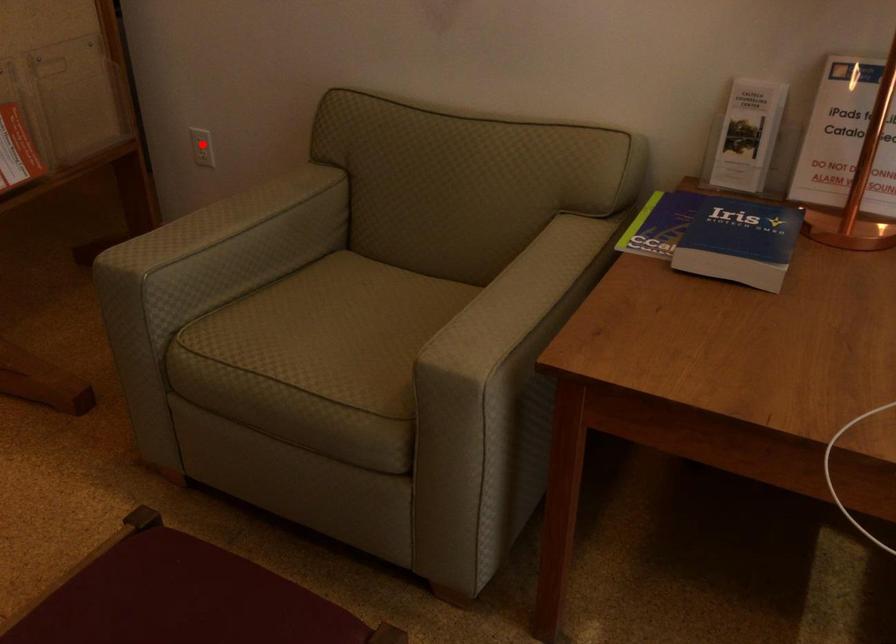
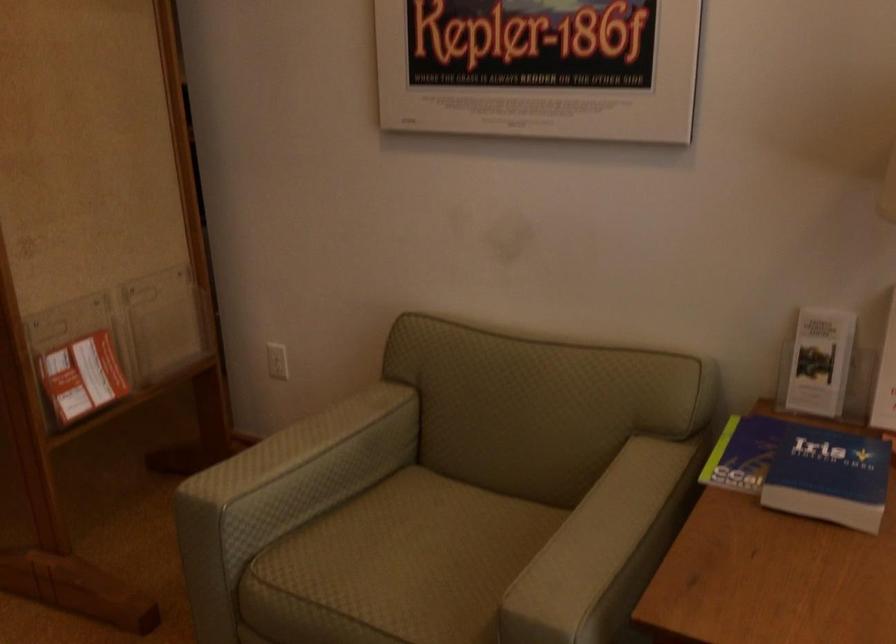
Where in the second image is the point corresponding to the highlighted location from the first image?

(277, 361)